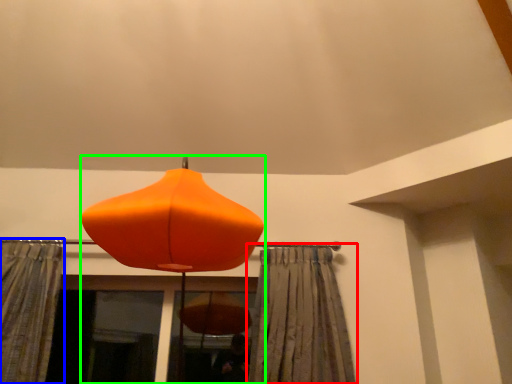
Question: Based on their relative distances, which object is farther from curtain (highlighted by a red box)? Choose from curtain (highlighted by a blue box) and lamp (highlighted by a green box).

Choices:
 (A) curtain
 (B) lamp

Answer: (A)